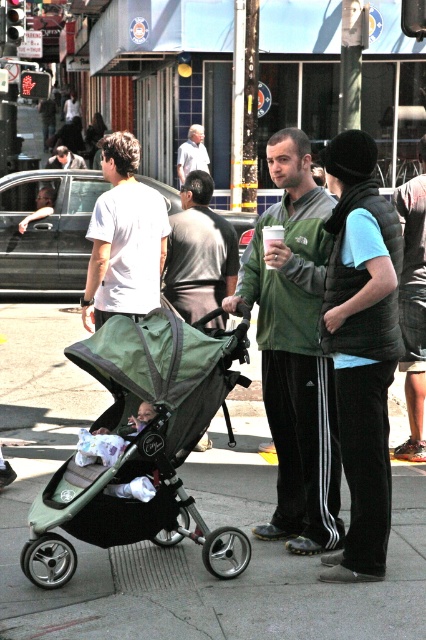
Question: Does white matte t-shirt at center appear under dark gray vest at center?

Choices:
 (A) no
 (B) yes

Answer: (A)

Question: Among these points, which one is nearest to the camera?

Choices:
 (A) (322, 340)
 (B) (207, 444)
 (C) (264, 236)
 (D) (397, 195)

Answer: (A)

Question: Is the position of green fabric stroller at center less distant than that of light gray shirt at center?

Choices:
 (A) yes
 (B) no

Answer: (A)

Question: Can you confirm if white matte t-shirt at center is positioned to the left of green puffy vest at center?

Choices:
 (A) yes
 (B) no

Answer: (A)

Question: Among these points, which one is nearest to the camera?

Choices:
 (A) (270, 268)
 (B) (193, 269)

Answer: (A)

Question: Which point is farther to the camera?

Choices:
 (A) (282, 237)
 (B) (291, 493)

Answer: (B)